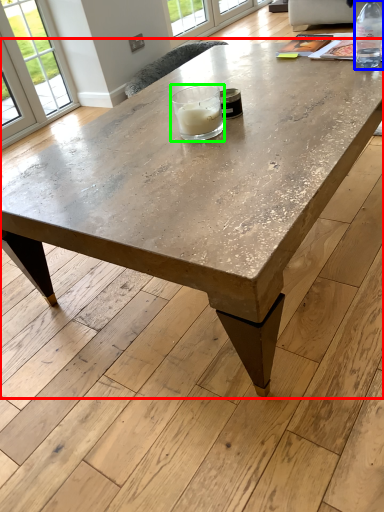
Question: Based on their relative distances, which object is nearer to coffee table (highlighted by a red box)? Choose from bottle (highlighted by a blue box) and candle holder (highlighted by a green box).

Choices:
 (A) bottle
 (B) candle holder

Answer: (B)